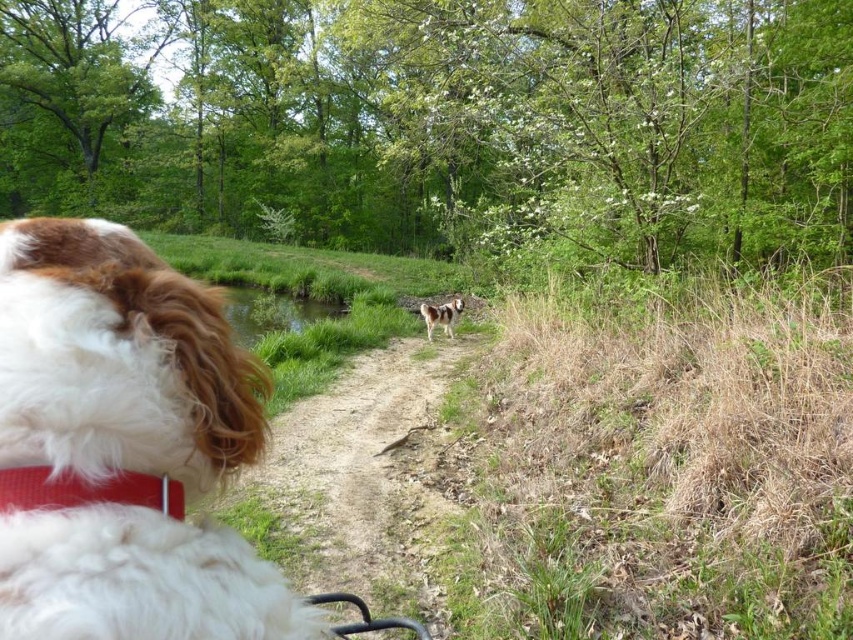
Looking at this image, which of these two, white fluffy dog at center or dirt path at center, stands taller?

With more height is white fluffy dog at center.

Between point (120, 612) and point (347, 500), which one is positioned in front?

Point (120, 612)

Which is behind, point (206, 358) or point (418, 344)?

Positioned behind is point (418, 344).

Identify the location of white fluffy dog at center. (125, 448).

Between white fluffy dog at center and brown and white fur at center, which one appears on the right side from the viewer's perspective?

brown and white fur at center

Find the location of a particular element. white fluffy dog at center is located at coordinates 125,448.

Identify the location of white fluffy dog at center. The image size is (853, 640). point(125,448).

I want to click on white fluffy dog at center, so click(x=125, y=448).

Does white fluffy dog at center appear on the right side of red fabric neckband at lower left?

No, white fluffy dog at center is not to the right of red fabric neckband at lower left.

Which of these two, white fluffy dog at center or red fabric neckband at lower left, stands taller?

Standing taller between the two is white fluffy dog at center.

Where is `white fluffy dog at center`? white fluffy dog at center is located at coordinates (125, 448).